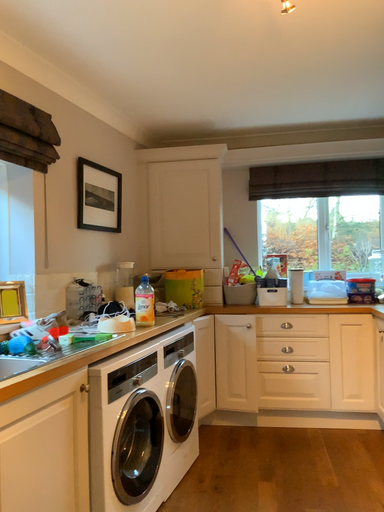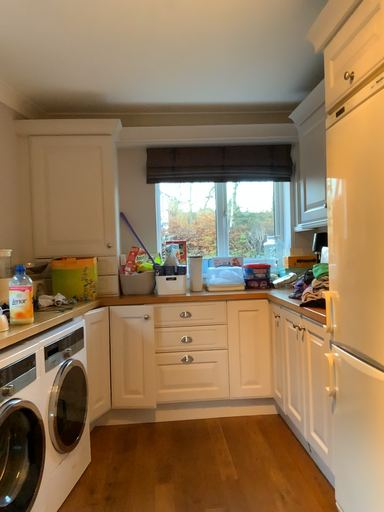
Question: How did the camera likely rotate when shooting the video?

Choices:
 (A) rotated left
 (B) rotated right

Answer: (B)